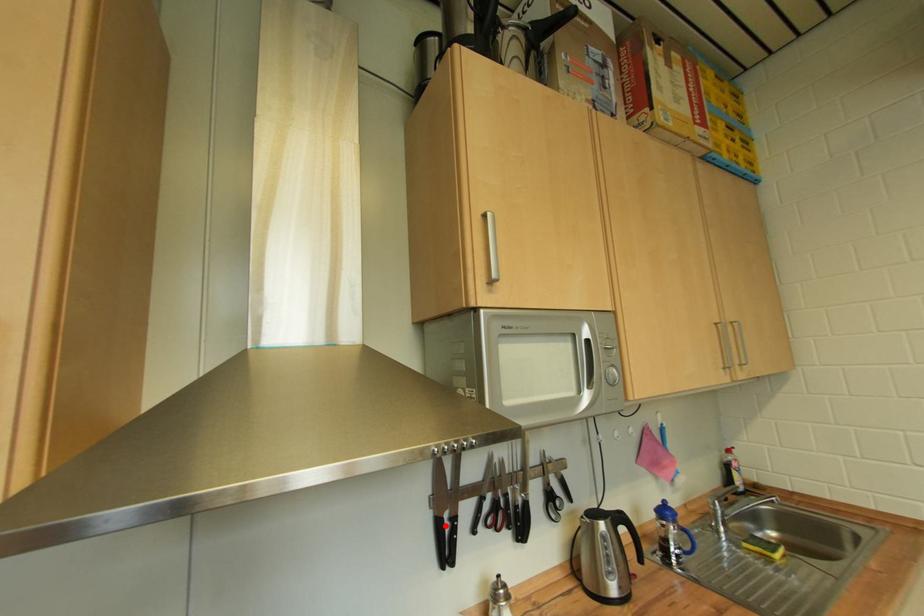
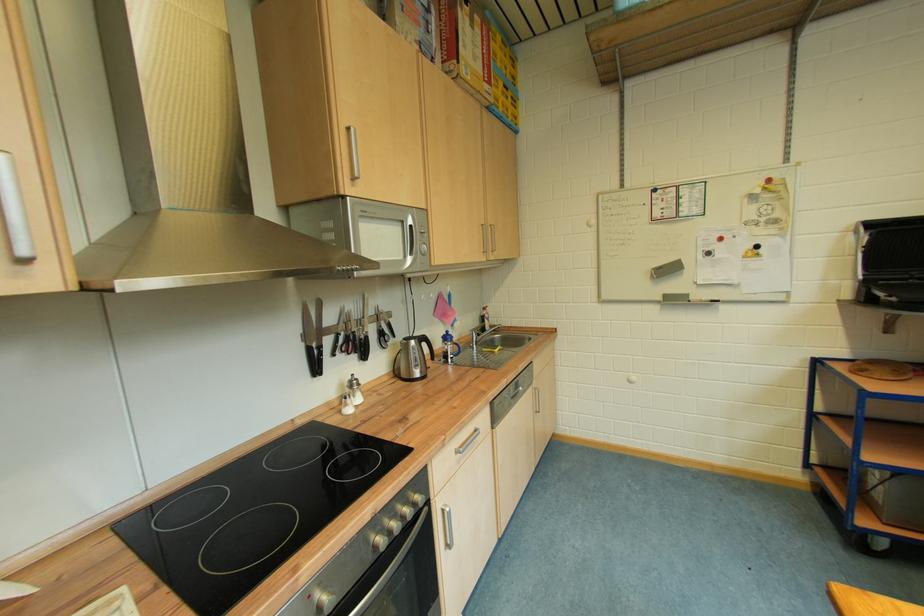
The point at the highlighted location is marked in the first image. Where is the corresponding point in the second image?

(317, 352)